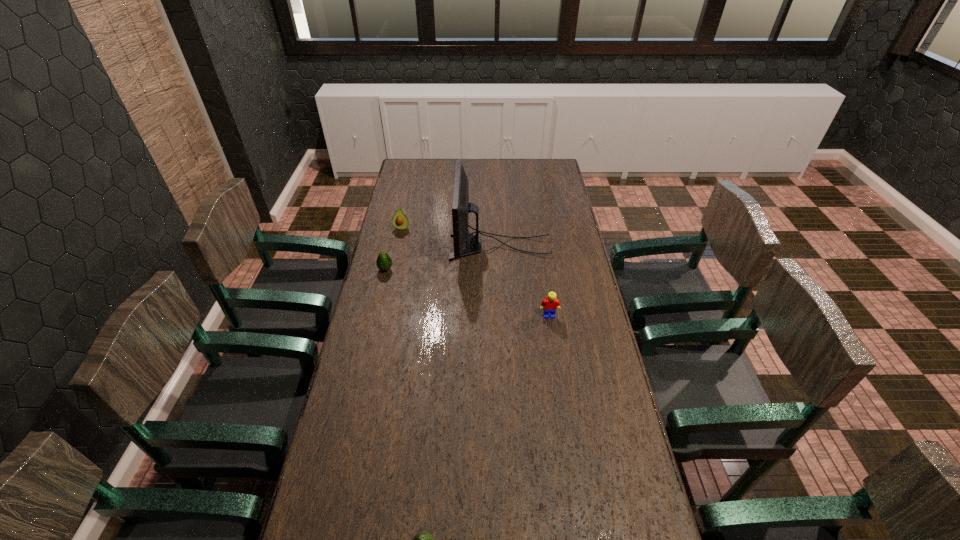
Locate an element on the screen. The width and height of the screenshot is (960, 540). the tallest object is located at coordinates (461, 207).

Identify the location of Lego. This screenshot has height=540, width=960. 550,304.

In order to click on the farthest avocado in this screenshot , I will do `click(399, 221)`.

This screenshot has width=960, height=540. What are the coordinates of `the second farthest avocado` in the screenshot? It's located at (383, 262).

Locate an element on the screen. vacant space located on the screen side of the computer monitor is located at coordinates (418, 246).

Identify the location of vacant region located 0.180m on the screen side of the computer monitor. The width and height of the screenshot is (960, 540). (409, 246).

Find the location of a particular element. The width and height of the screenshot is (960, 540). vacant space situated on the screen side of the computer monitor is located at coordinates (434, 246).

Locate an element on the screen. Image resolution: width=960 pixels, height=540 pixels. vacant space situated 0.090m on the front-facing side of the Lego is located at coordinates (552, 338).

I want to click on free space located on the cut side of the farthest avocado, so click(396, 255).

Where is `free space located on the right of the second nearest avocado`? free space located on the right of the second nearest avocado is located at coordinates (467, 269).